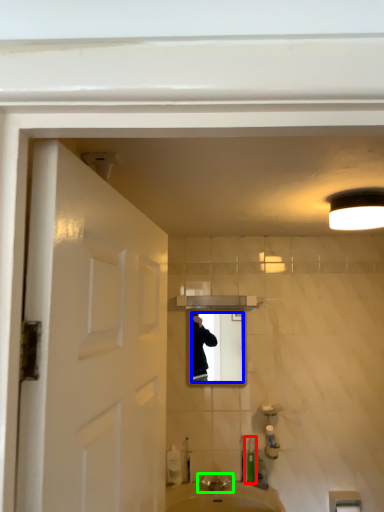
Question: Which object is positioned closest to toiletry (highlighted by a red box)? Select from mirror (highlighted by a blue box) and tap (highlighted by a green box).

Choices:
 (A) mirror
 (B) tap

Answer: (B)